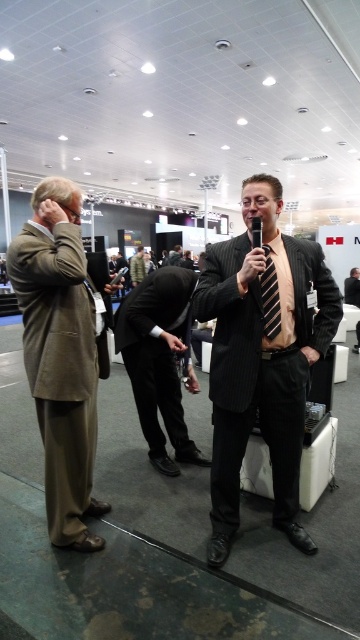
You are standing in the conference hall and see two points marked in the image. Which point is closer to you, point (79, 252) or point (156, 433)?

Point (79, 252) is closer to the viewer than point (156, 433).